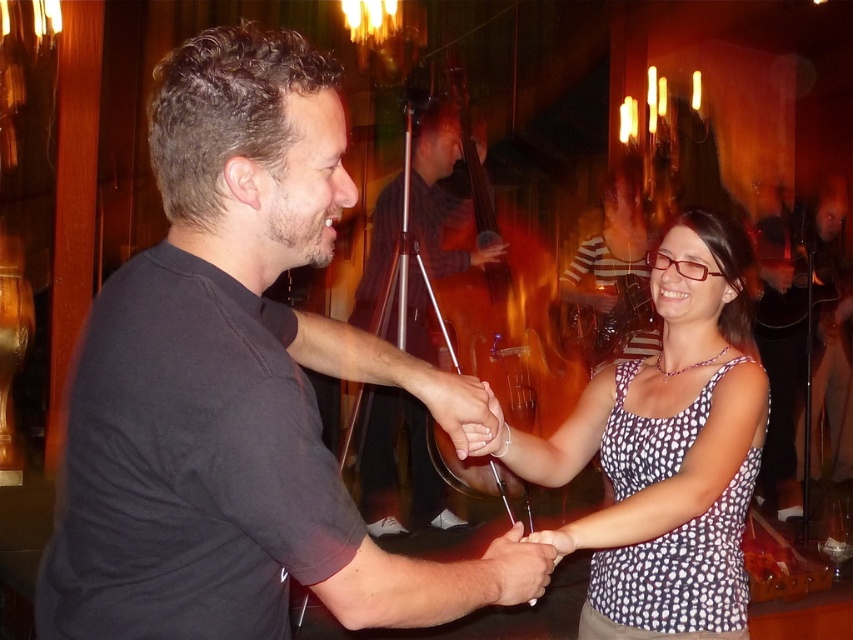
Does smooth skin at center appear under matte black hand at center?

Correct, smooth skin at center is located below matte black hand at center.

In the scene shown: Which of these two, smooth skin at center or matte black hand at center, stands taller?

With more height is smooth skin at center.

What do you see at coordinates (462, 412) in the screenshot? This screenshot has height=640, width=853. I see `smooth skin at center` at bounding box center [462, 412].

You are a GUI agent. You are given a task and a screenshot of the screen. Output one action in this format:
    pyautogui.click(x=<x>, y=<y>)
    Task: Click on the smooth skin at center
    
    Given the screenshot: What is the action you would take?
    pyautogui.click(x=462, y=412)

Which of these two, black matte shirt at center or black matte hand at center, stands shorter?

black matte shirt at center is shorter.

Locate an element on the screen. This screenshot has width=853, height=640. black matte shirt at center is located at coordinates (225, 381).

Between point (62, 476) and point (395, 438), which one is positioned in front?

Positioned in front is point (62, 476).

At what (x,y) coordinates should I click in order to perform the action: click on black matte shirt at center. Please return your answer as a coordinate pair (x, y). Looking at the image, I should click on (225, 381).

Is black matte hand at center shorter than matte black hand at center?

Incorrect, black matte hand at center's height does not fall short of matte black hand at center's.

Is point (444, 161) closer to viewer compared to point (473, 262)?

No.

I want to click on black matte hand at center, so click(396, 468).